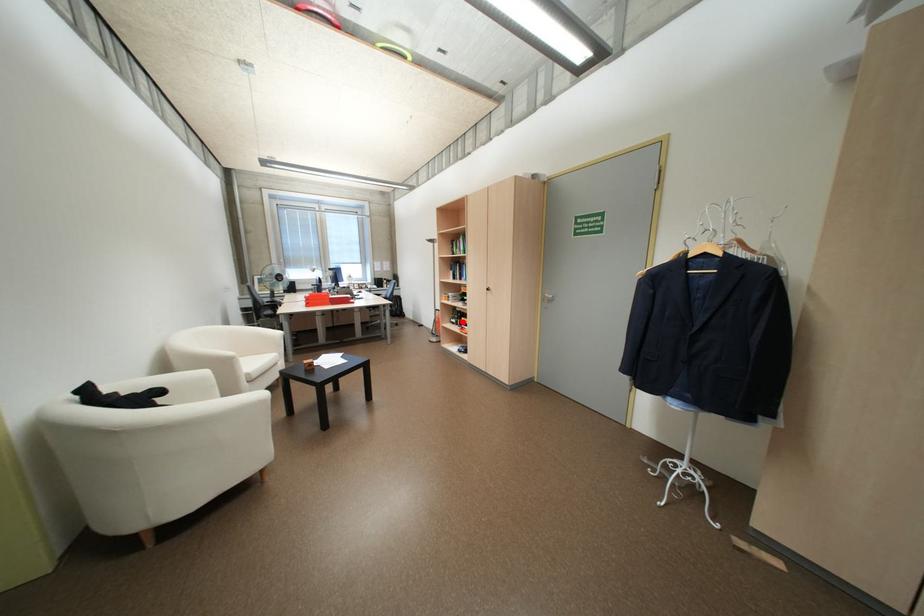
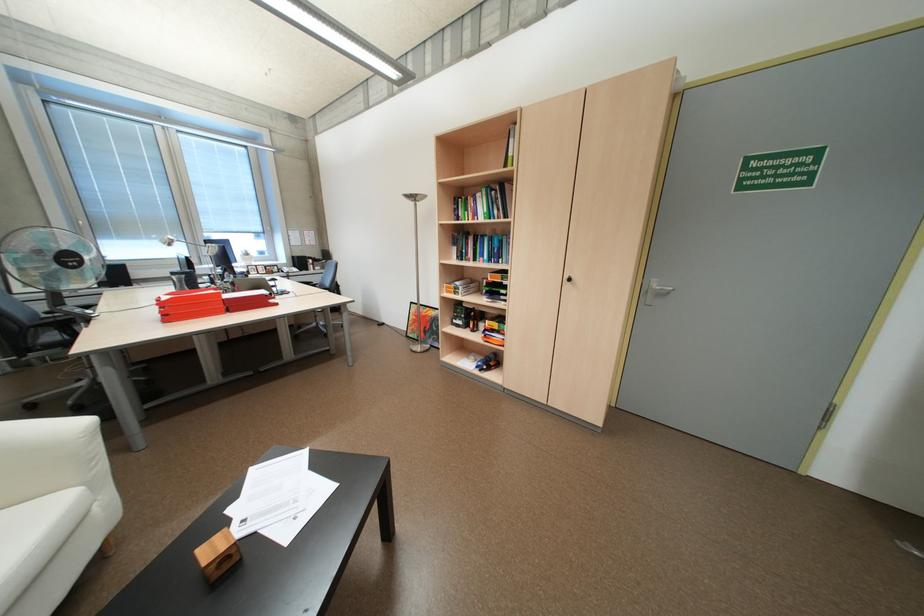
Question: I am providing you with two images of the same scene from different viewpoints. In image1, a red point is highlighted. Considering the same 3D point in image2, which of the following is correct?

Choices:
 (A) It is closer
 (B) It is farther

Answer: (A)